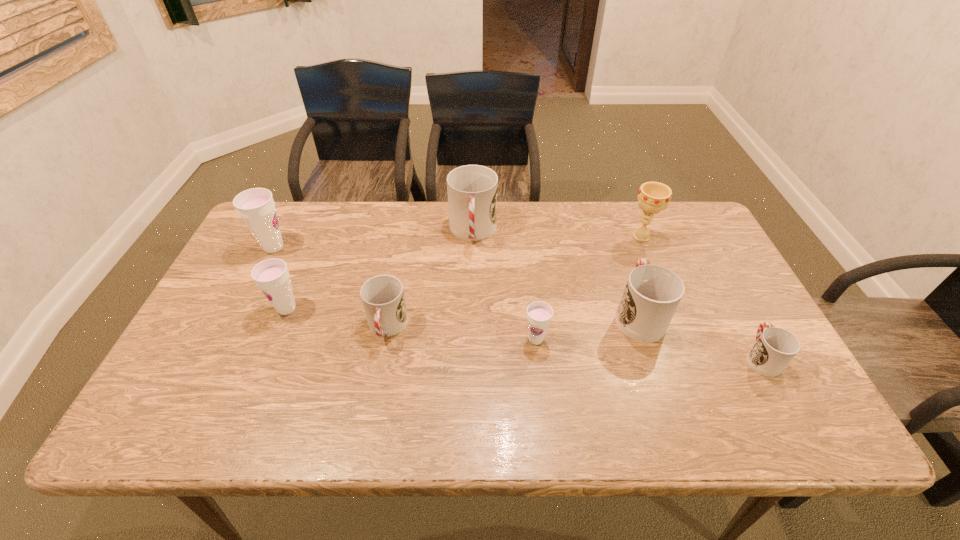
Locate an element on the screen. The width and height of the screenshot is (960, 540). the leftmost purple cup is located at coordinates (256, 206).

This screenshot has width=960, height=540. I want to click on the leftmost object, so click(256, 206).

This screenshot has height=540, width=960. Identify the location of the fourth cup from right to left. coord(472,190).

Locate an element on the screen. Image resolution: width=960 pixels, height=540 pixels. the second red cup from left to right is located at coordinates (472, 190).

Identify the location of chalice. (653, 197).

The height and width of the screenshot is (540, 960). Find the location of `the second red cup from right to left`. the second red cup from right to left is located at coordinates (652, 294).

At what (x,y) coordinates should I click in order to perform the action: click on the second biggest red cup. Please return your answer as a coordinate pair (x, y). The height and width of the screenshot is (540, 960). Looking at the image, I should click on (652, 294).

This screenshot has width=960, height=540. I want to click on the second purple cup from right to left, so click(272, 276).

At what (x,y) coordinates should I click in order to perform the action: click on the second biggest purple cup. Please return your answer as a coordinate pair (x, y). The image size is (960, 540). Looking at the image, I should click on (272, 276).

I want to click on the sixth object from right to left, so click(382, 296).